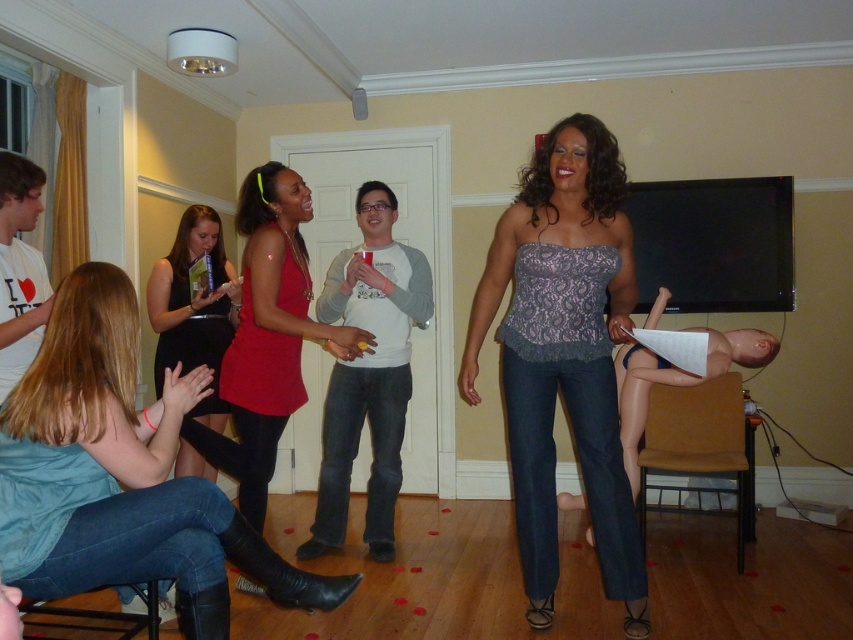
Measure the distance from denim jeans at lower left to matte red dress at center.

The distance of denim jeans at lower left from matte red dress at center is 27.99 inches.

Image resolution: width=853 pixels, height=640 pixels. What do you see at coordinates (120, 474) in the screenshot?
I see `denim jeans at lower left` at bounding box center [120, 474].

The image size is (853, 640). What are the coordinates of `denim jeans at lower left` in the screenshot? It's located at (120, 474).

Which of these two, matte red dress at center or black satin dress at lower left, stands taller?

Standing taller between the two is matte red dress at center.

Who is shorter, matte red dress at center or black satin dress at lower left?

black satin dress at lower left

Who is more distant from viewer, (233, 376) or (169, 358)?

The point (169, 358) is behind.

Where is `matte red dress at center`? The width and height of the screenshot is (853, 640). matte red dress at center is located at coordinates (268, 337).

Does point (555, 172) come closer to viewer compared to point (212, 244)?

Yes.

Between point (560, 381) and point (183, 448), which one is positioned in front?

Point (560, 381)

Identify the location of lace-like fabric top at center. (564, 355).